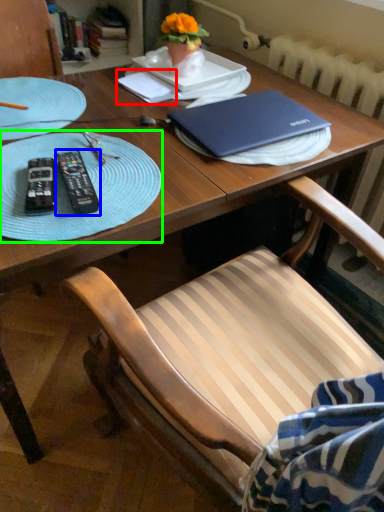
Question: Which object is positioned closest to notepad (highlighted by a red box)? Select from remote control (highlighted by a blue box) and glass plate (highlighted by a green box).

Choices:
 (A) remote control
 (B) glass plate

Answer: (B)